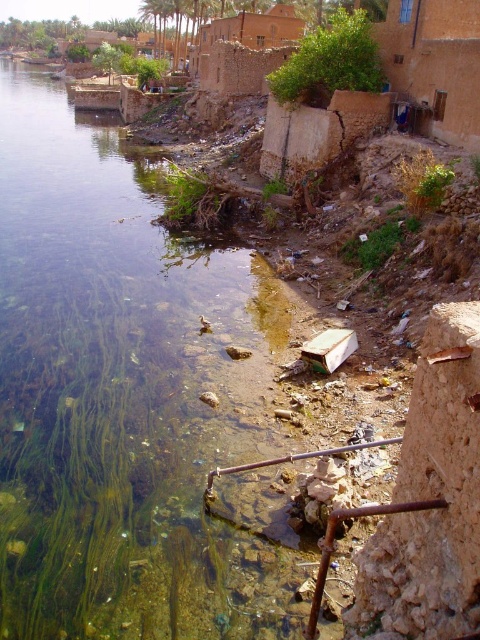
You are a photographer planning to capture the entire scene in one shot. Given that your camera can only focus on objects within a 10m width, will the clear water at river left and the green leafy bush at upper center fit within the camera frame?

The clear water at river left is wider than the green leafy bush at upper center. Since the camera can focus on objects within a 10m width, and the clear water at river left is the wider of the two, it depends on the actual width of the clear water. However, the description only states their relative sizes, not absolute measurements. Without knowing the exact width of the clear water, we cannot definitively say if both will fit within the 10m frame.

You are a photographer standing at the riverside. You want to capture a photo where the clear water at river left and the green leafy bush at upper center are both in focus. Considering their heights, which object should you position closer to the camera to ensure both are sharp?

The clear water at river left is taller than the green leafy bush at upper center. To ensure both are in focus, you should position the camera closer to the taller object, which is the clear water at river left, as depth of field is more effective when the subject is closer.